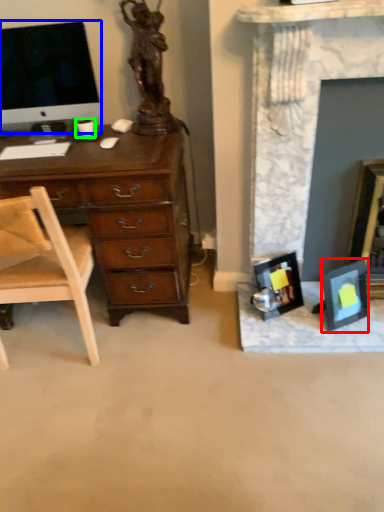
Question: Which object is the farthest from picture frame (highlighted by a red box)? Choose among these: television (highlighted by a blue box) or coffee cup (highlighted by a green box).

Choices:
 (A) television
 (B) coffee cup

Answer: (A)